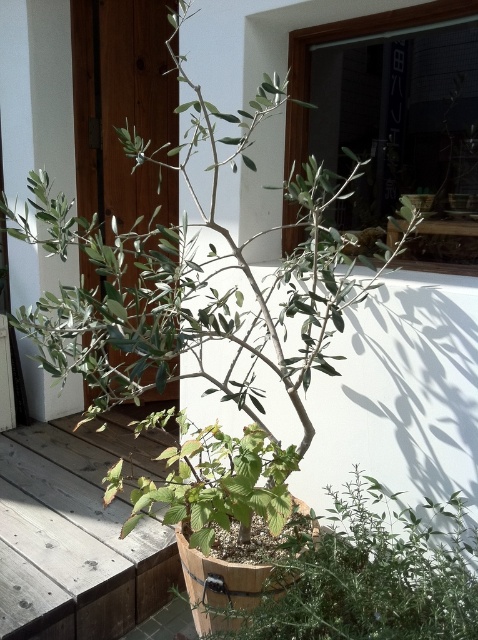
You are a gardener who wants to water both the green leafy plant at center and the green matte plant at center. Which plant should you water first if you want to reach the lower one first?

The green leafy plant at center is below the green matte plant at center, so you should water the green leafy plant at center first.

You are a gardener who needs to water the green leafy plant at center. Your watering can is on a table 1.5 meters away from you. Can you reach the watering can without moving from your current position to water the plant?

The distance between you and the green leafy plant at center is 1.20 meters, which is less than the 1.5 meters to the watering can. Since the watering can is farther away, you cannot reach it without moving closer. Therefore, you need to move towards the table to get the watering can.

You are standing in front of the potted plant and want to reach a point that is exactly 1.41 meters away from you. Can you confirm if the point at coordinates point (325,586) is exactly 1.41 meters away from your current position?

Yes, the point at coordinates point (325,586) is exactly 1.41 meters away from the viewer, so you can confirm that it is the correct point.